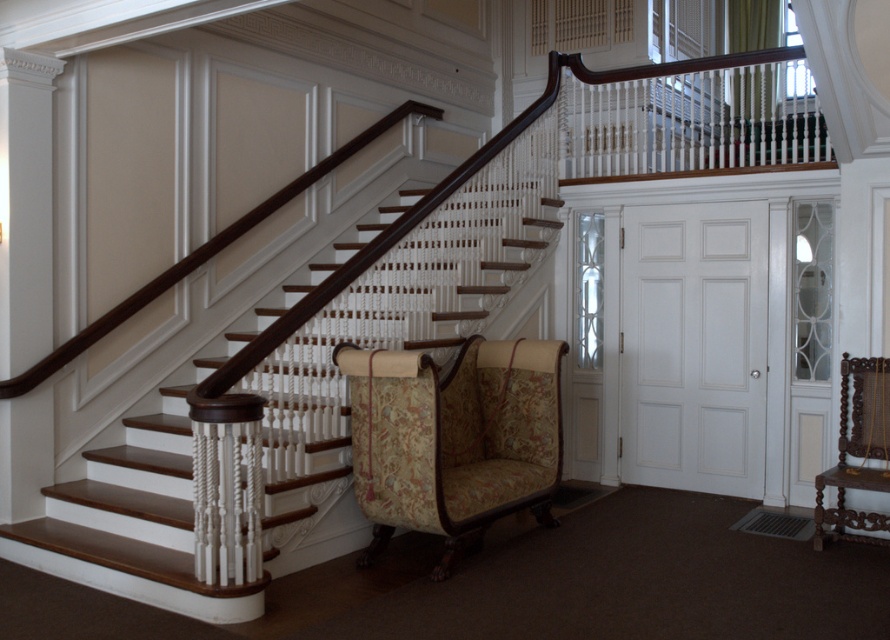
Question: Can you confirm if patterned fabric armchair at center is positioned above white wood balustrade at upper center?

Choices:
 (A) yes
 (B) no

Answer: (B)

Question: Does wooden staircase at center have a smaller size compared to carved wood armchair at lower right?

Choices:
 (A) yes
 (B) no

Answer: (B)

Question: Is wooden staircase at center wider than white wood balustrade at upper center?

Choices:
 (A) yes
 (B) no

Answer: (B)

Question: Which is farther from the patterned fabric armchair at center?

Choices:
 (A) white wood balustrade at upper center
 (B) carved wood armchair at lower right

Answer: (A)

Question: Which object is farther from the camera taking this photo?

Choices:
 (A) patterned fabric armchair at center
 (B) carved wood armchair at lower right
 (C) white wood balustrade at upper center
 (D) wooden staircase at center

Answer: (C)

Question: Based on their relative distances, which object is nearer to the white wood balustrade at upper center?

Choices:
 (A) carved wood armchair at lower right
 (B) wooden staircase at center
 (C) patterned fabric armchair at center

Answer: (A)